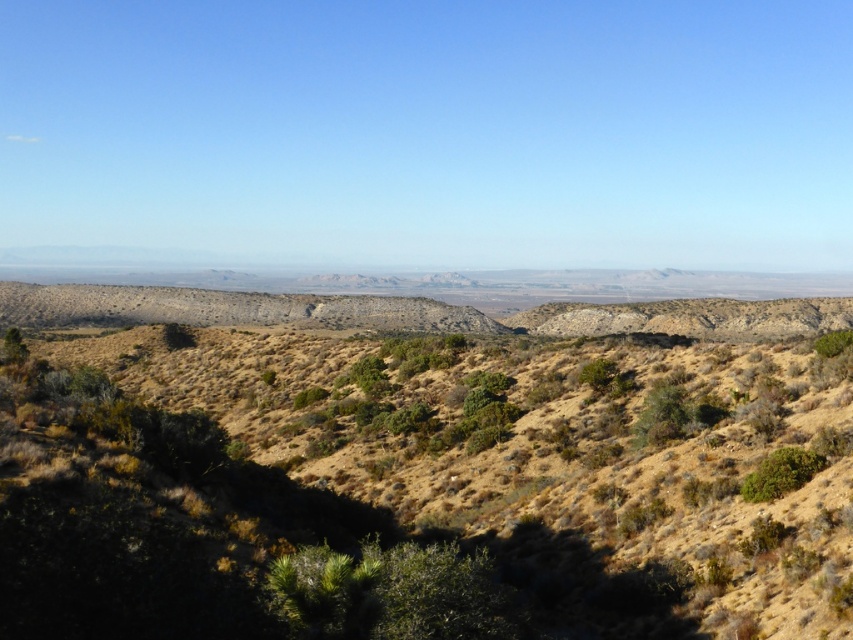
You are a hiker who needs to cross from the dry grassland at center to the green leafy bush at lower right. Given that your average walking pace is 1.5 meters per second, how long will it take you to reach the bush?

The distance between the dry grassland at center and the green leafy bush at lower right is 13.45 meters. At a pace of 1.5 meters per second, dividing the distance by the speed gives approximately 8.97 seconds. Therefore, it will take roughly 9 seconds to reach the bush.

You are standing at point (x=403, y=480) in the desert landscape. What type of terrain do you see around you?

The terrain at point (x=403, y=480) is dry grassland at center.

What is the exact coordinate of the dry grassland at center?

The dry grassland at center is located at point (403, 480).